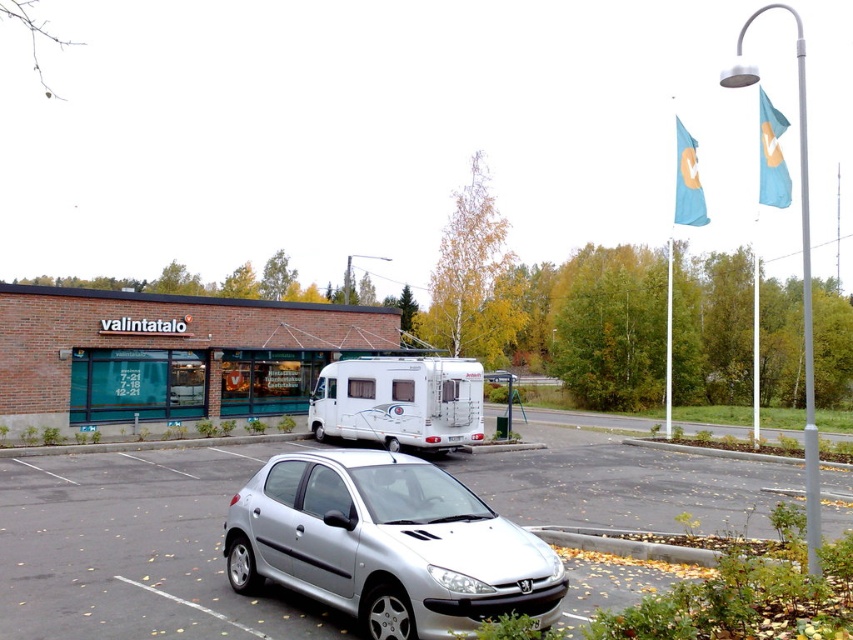
You are standing at the entrance of the building labeled valintatalo and want to locate the silver metallic car at lower center. Based on the coordinates provided, in which direction should you walk to find the car?

The silver metallic car at lower center is located at coordinates point (386, 545). Since the entrance is at the lower part of the image, you should walk towards the upper direction to reach the car.

You are a delivery driver who needs to park your truck in the parking area next to the valintatalo building. The truck requires a parking space that is at least as wide as the silver metallic car at center. Can you determine if the parking space currently occupied by the white glossy camper at center is wide enough for your truck?

The silver metallic car at center is wider than the white glossy camper at center. Since the parking space occupied by the white glossy camper at center is not wide enough to accommodate the silver metallic car at center, it would also be too narrow for your truck which requires a space at least as wide as the silver metallic car at center.